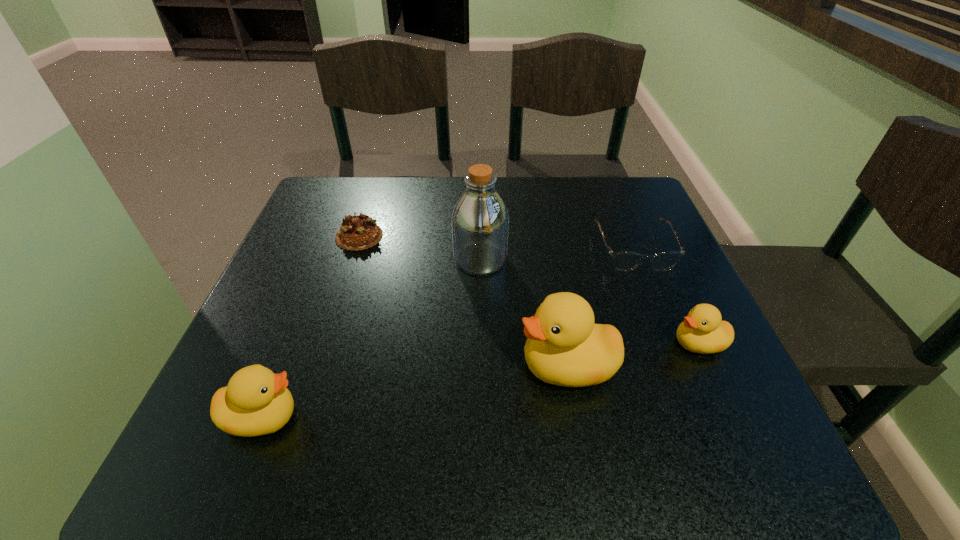
In the image, there is a desktop. Identify the location of free space at the near edge. (482, 376).

What are the coordinates of `vacant space at the right edge` in the screenshot? It's located at (655, 338).

In the image, there is a desktop. Identify the location of vacant space at the far left corner. (365, 208).

The width and height of the screenshot is (960, 540). Find the location of `free space at the far right corner of the desktop`. free space at the far right corner of the desktop is located at coordinates (610, 206).

Image resolution: width=960 pixels, height=540 pixels. In order to click on vacant space that's between the chocolate cake and the fifth shortest object in this screenshot , I will do `click(463, 301)`.

Find the location of a particular element. The width and height of the screenshot is (960, 540). free space between the tallest duckling and the chocolate cake is located at coordinates (463, 301).

The width and height of the screenshot is (960, 540). I want to click on free point between the second shortest duckling and the third object from right to left, so click(415, 391).

Locate an element on the screen. The image size is (960, 540). free space between the leftmost duckling and the chocolate cake is located at coordinates [311, 327].

Locate an element on the screen. This screenshot has width=960, height=540. empty location between the spectacles and the rightmost duckling is located at coordinates (666, 295).

You are a GUI agent. You are given a task and a screenshot of the screen. Output one action in this format:
    pyautogui.click(x=<x>, y=<y>)
    Task: Click on the empty space between the spectacles and the tallest duckling
    
    Given the screenshot: What is the action you would take?
    pyautogui.click(x=600, y=307)